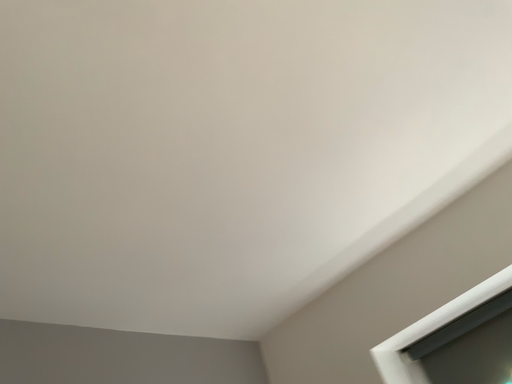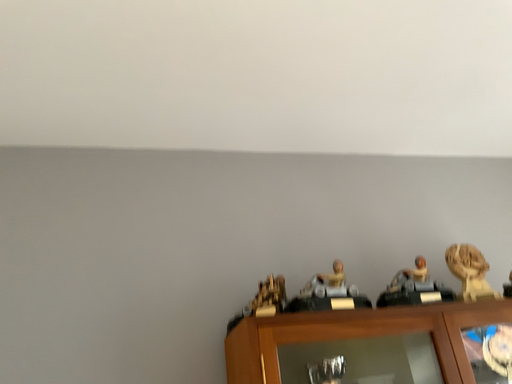
Question: How did the camera likely rotate when shooting the video?

Choices:
 (A) rotated right
 (B) rotated left

Answer: (B)